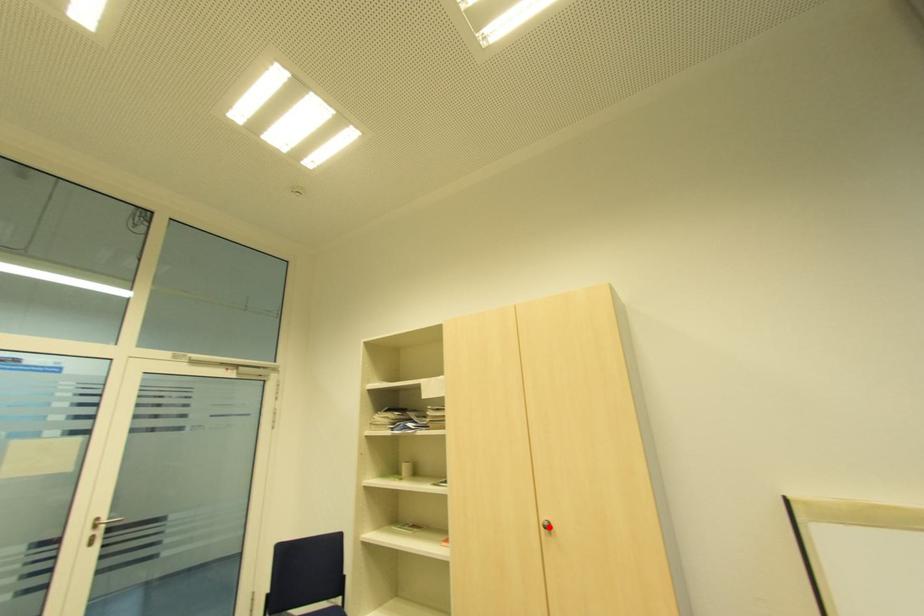
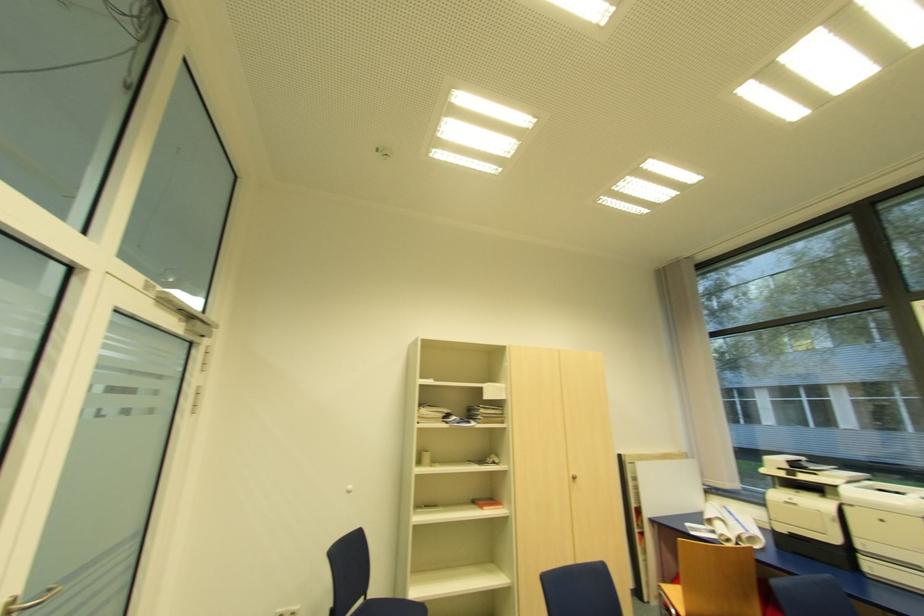
In the second image, find the point that corresponds to the highlighted location in the first image.

(576, 477)